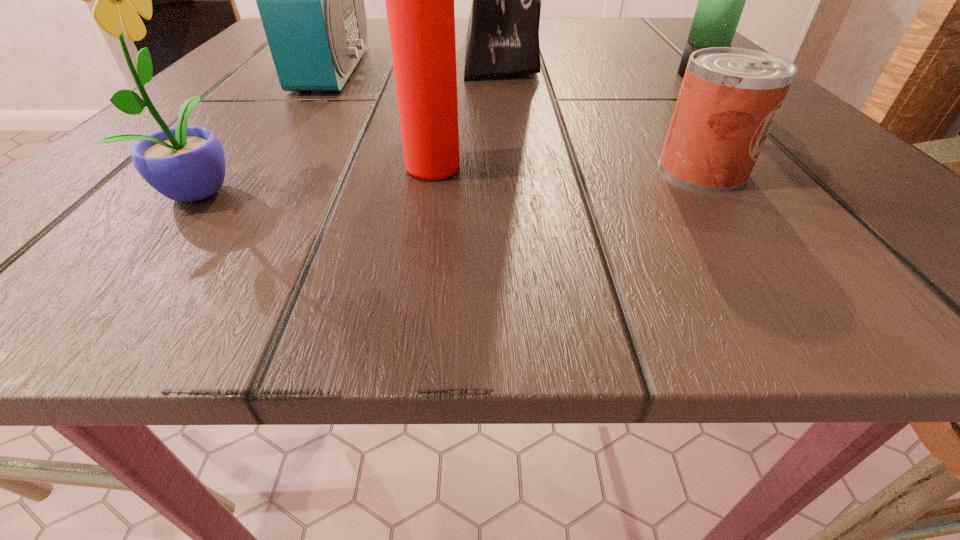
Locate an element on the screen. This screenshot has height=540, width=960. thermos bottle positioned at the right edge is located at coordinates (721, 1).

Image resolution: width=960 pixels, height=540 pixels. I want to click on can present at the right edge, so click(729, 98).

Image resolution: width=960 pixels, height=540 pixels. Identify the location of object present at the far left corner. (311, 0).

Identify the location of vacant position at the far edge of the desktop. This screenshot has height=540, width=960. pyautogui.click(x=569, y=45).

In the image, there is a desktop. What are the coordinates of `vacant space at the left edge` in the screenshot? It's located at (214, 107).

This screenshot has height=540, width=960. What are the coordinates of `vacant space at the right edge of the desktop` in the screenshot? It's located at (872, 188).

You are a GUI agent. You are given a task and a screenshot of the screen. Output one action in this format:
    pyautogui.click(x=<x>, y=<y>)
    Task: Click on the blank space at the far right corner
    This screenshot has width=960, height=540.
    Given the screenshot: What is the action you would take?
    pyautogui.click(x=650, y=30)

Where is `vacant area that lies between the shortest object and the sunflower`? This screenshot has width=960, height=540. vacant area that lies between the shortest object and the sunflower is located at coordinates (452, 179).

Where is `vacant space that's between the can and the left thermos bottle`? vacant space that's between the can and the left thermos bottle is located at coordinates (570, 169).

Locate an element on the screen. The height and width of the screenshot is (540, 960). empty location between the sunflower and the can is located at coordinates (452, 179).